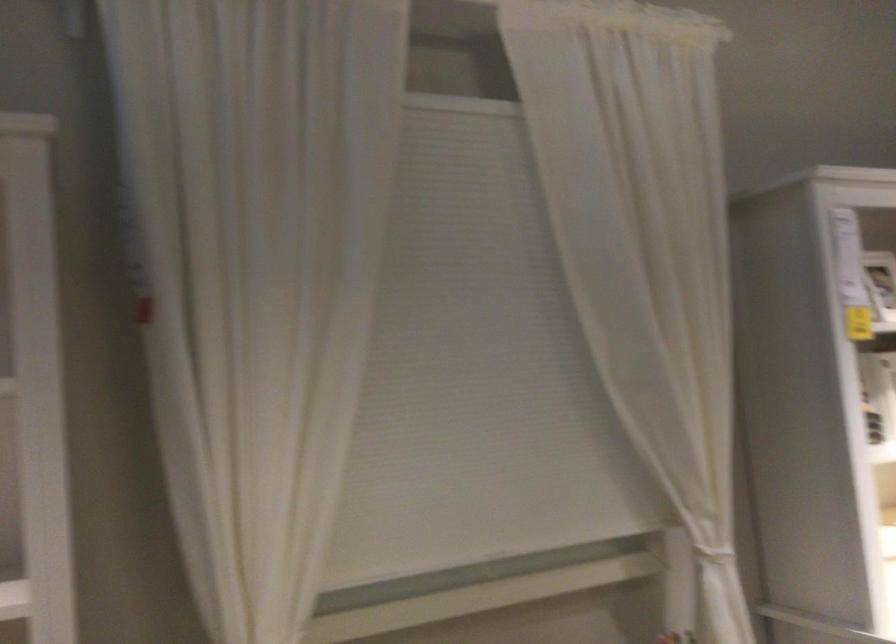
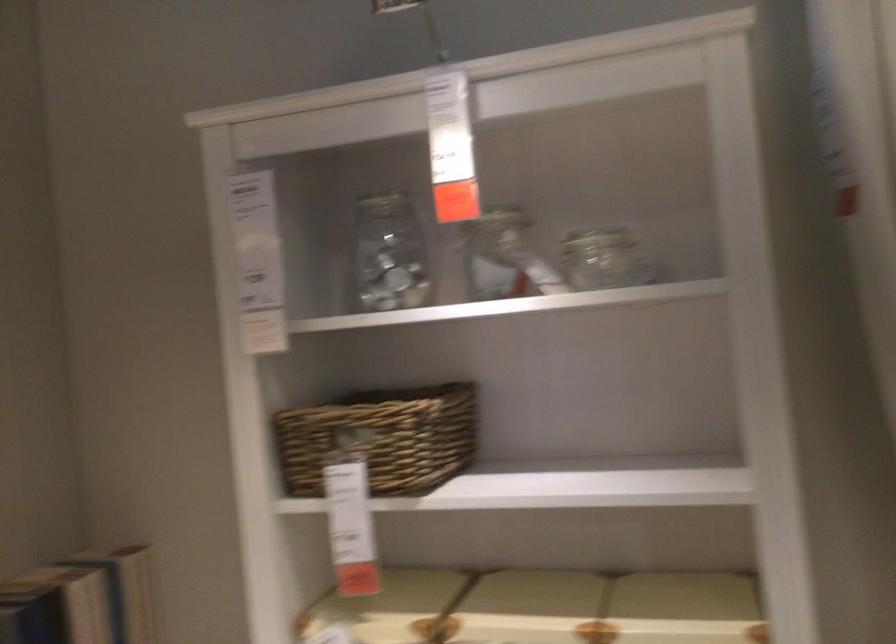
Question: The first image is from the beginning of the video and the second image is from the end. How did the camera likely rotate when shooting the video?

Choices:
 (A) Left
 (B) Right
 (C) Up
 (D) Down

Answer: (A)